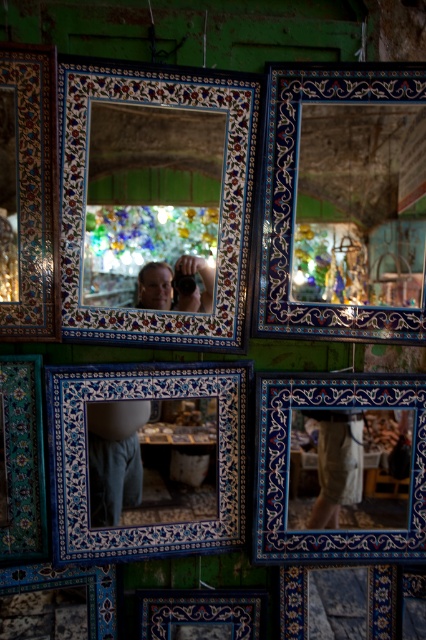
Question: Which point is farther from the camera taking this photo?

Choices:
 (A) (23, 424)
 (B) (114, 608)
 (C) (278, 204)

Answer: (B)

Question: Which object is closer to the camera taking this photo?

Choices:
 (A) blue ceramic mirror at center
 (B) blue ceramic mirror at upper right
 (C) blue mosaic mirror at lower right

Answer: (B)

Question: Does matte ceramic mirror at center have a lesser width compared to blue ceramic tile at lower left?

Choices:
 (A) no
 (B) yes

Answer: (A)

Question: Is matte ceramic mirror at center smaller than matte blue tile picture frame at lower left?

Choices:
 (A) no
 (B) yes

Answer: (A)

Question: Is blue mosaic mirror at lower right closer to the viewer compared to blue ceramic tile at lower left?

Choices:
 (A) yes
 (B) no

Answer: (B)

Question: Estimate the real-world distances between objects in this image. Which object is closer to the matte blue tile at bottom center?

Choices:
 (A) blue ceramic mirror at center
 (B) matte ceramic mirror at center
 (C) blue ceramic mirror at upper right

Answer: (A)